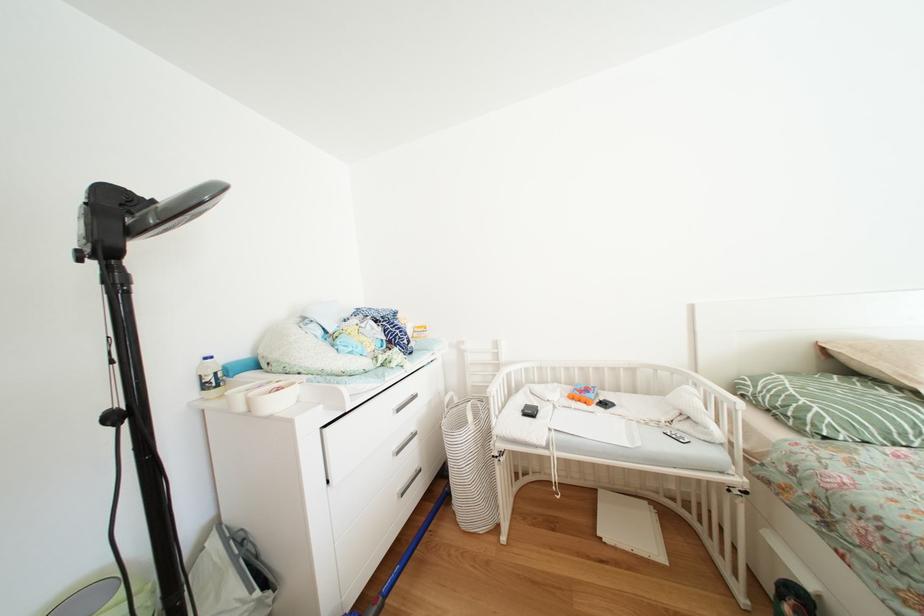
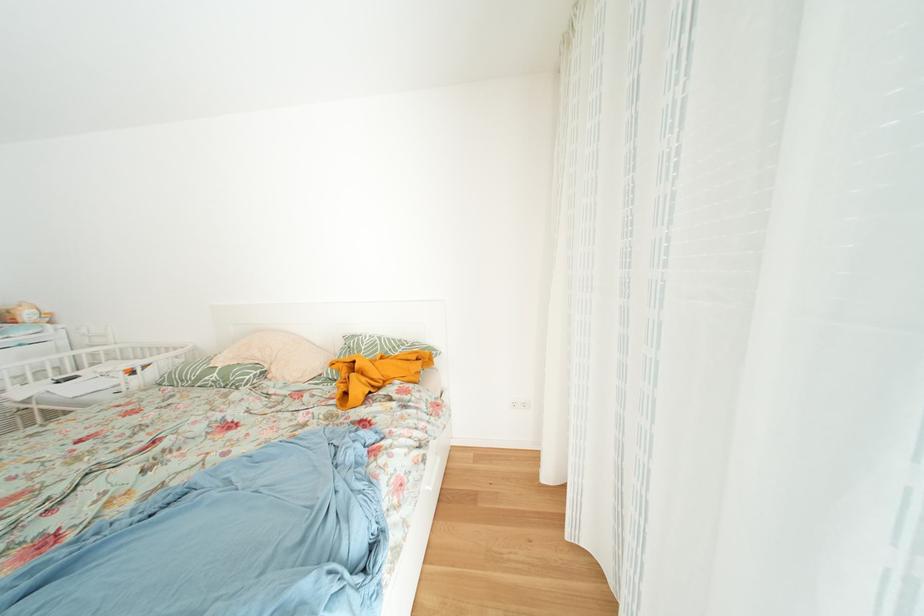
Which direction would the cameraman need to move to produce the second image?

The cameraman moved toward right, backward.